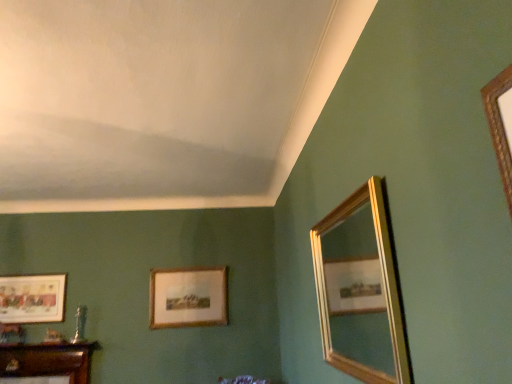
Question: Considering the relative sizes of matte gold picture frame at lower left, arranged as the first picture frame when viewed from the left, and gold-framed picture at center, which appears as the second picture frame when viewed from the left, in the image provided, is matte gold picture frame at lower left, arranged as the first picture frame when viewed from the left, taller than gold-framed picture at center, which appears as the second picture frame when viewed from the left,?

Choices:
 (A) no
 (B) yes

Answer: (A)

Question: Is matte gold picture frame at lower left, arranged as the first picture frame when viewed from the left, shorter than gold-framed picture at center, acting as the first picture frame starting from the right?

Choices:
 (A) yes
 (B) no

Answer: (A)

Question: Could you tell me if matte gold picture frame at lower left, arranged as the second picture frame when viewed from the right, is facing gold-framed picture at center, acting as the first picture frame starting from the right?

Choices:
 (A) no
 (B) yes

Answer: (A)

Question: Does matte gold picture frame at lower left, arranged as the first picture frame when viewed from the left, have a larger size compared to gold-framed picture at center, acting as the first picture frame starting from the right?

Choices:
 (A) yes
 (B) no

Answer: (B)

Question: Is matte gold picture frame at lower left, arranged as the first picture frame when viewed from the left, to the right of gold-framed picture at center, which appears as the second picture frame when viewed from the left, from the viewer's perspective?

Choices:
 (A) yes
 (B) no

Answer: (B)

Question: Is matte gold picture frame at lower left, arranged as the second picture frame when viewed from the right, outside of gold-framed picture at center, which appears as the second picture frame when viewed from the left?

Choices:
 (A) yes
 (B) no

Answer: (A)

Question: Is gold-framed picture at center, acting as the first picture frame starting from the right, positioned behind gold-framed mirror at right?

Choices:
 (A) no
 (B) yes

Answer: (B)

Question: Is gold-framed picture at center, which appears as the second picture frame when viewed from the left, positioned before gold-framed mirror at right?

Choices:
 (A) no
 (B) yes

Answer: (A)

Question: Is gold-framed picture at center, which appears as the second picture frame when viewed from the left, taller than gold-framed mirror at right?

Choices:
 (A) no
 (B) yes

Answer: (A)

Question: Does gold-framed picture at center, which appears as the second picture frame when viewed from the left, have a lesser width compared to gold-framed mirror at right?

Choices:
 (A) no
 (B) yes

Answer: (B)

Question: Is the surface of gold-framed picture at center, acting as the first picture frame starting from the right, in direct contact with gold-framed mirror at right?

Choices:
 (A) yes
 (B) no

Answer: (B)

Question: From a real-world perspective, does gold-framed picture at center, acting as the first picture frame starting from the right, sit lower than gold-framed mirror at right?

Choices:
 (A) no
 (B) yes

Answer: (A)

Question: From a real-world perspective, is matte gold picture frame at lower left, arranged as the second picture frame when viewed from the right, over gold-framed mirror at right?

Choices:
 (A) no
 (B) yes

Answer: (B)